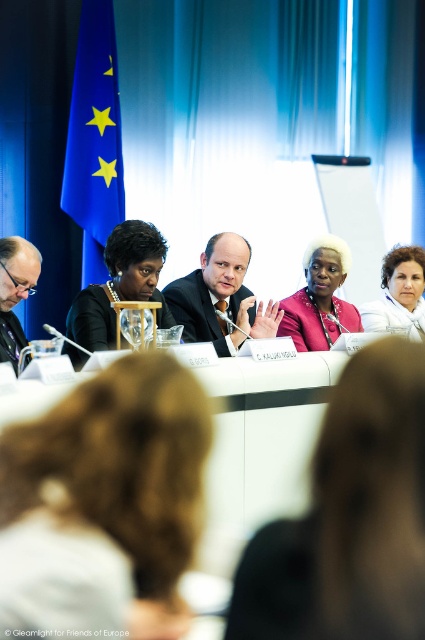
You are sitting at the conference table in the image and want to pass a document to someone. You have two points on the table where you can place the document. The first point is at coordinate point(286,518) and the second is at coordinate point(62,184). Which point is closer to you as you sit at the table?

Point(286,518) is in front of point(62,184), so the document placed at point(286,518) will be closer to you.

You are attending a formal meeting and need to locate the European Union flag. You see the blue fabric flag at left and the smooth black suit at center. Which object is positioned to the left of the other?

The blue fabric flag at left is positioned to the left of the smooth black suit at center.

You are a photographer adjusting your camera to capture the meeting scene. You notice two points of interest marked at coordinates point (93, 74) and point (198, 339). Which point is closer to your camera lens?

Point (93, 74) is further to the camera than point (198, 339), so the point closer to the camera lens is point (198, 339).